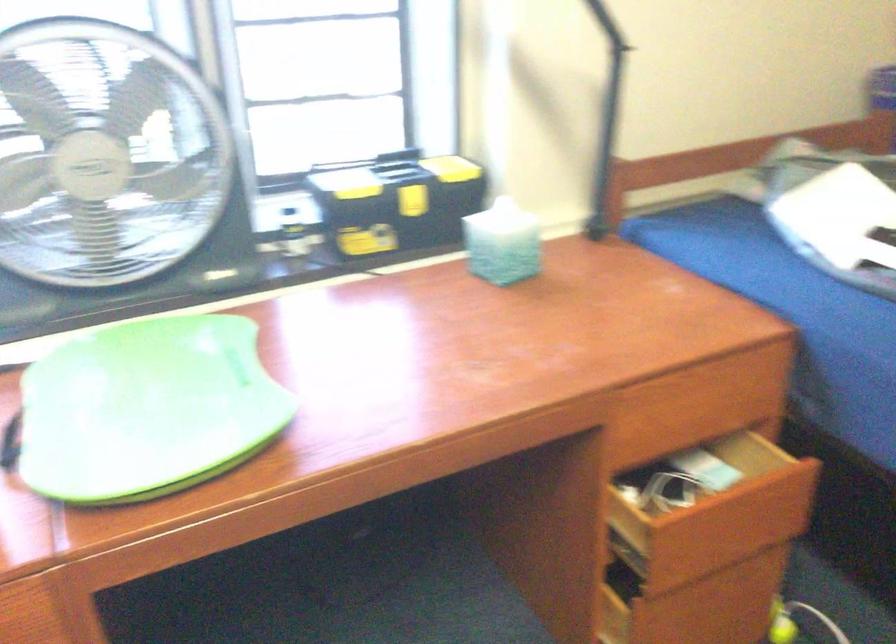
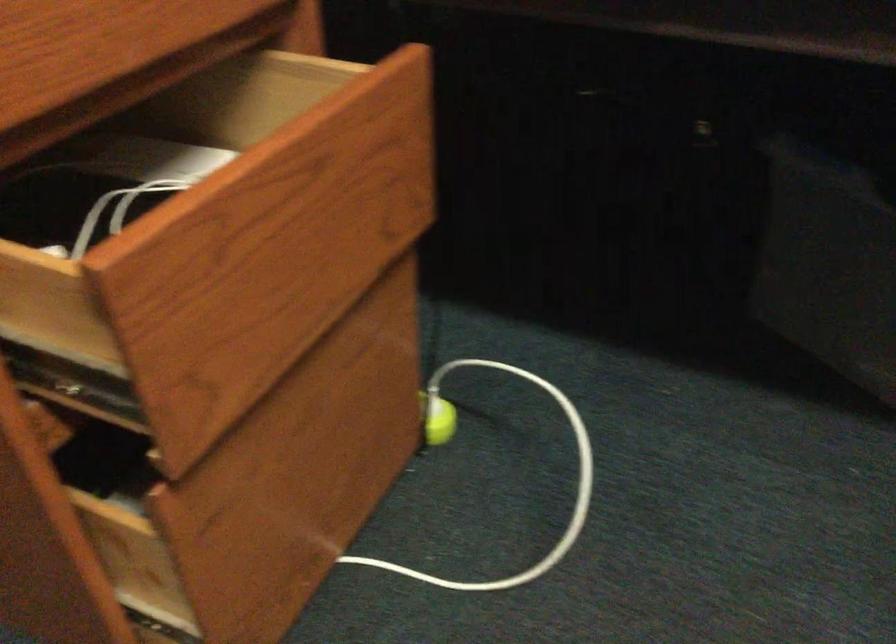
Question: The images are taken continuously from a first-person perspective. In which direction is your viewpoint rotating?

Choices:
 (A) Left
 (B) Right
 (C) Up
 (D) Down

Answer: (B)